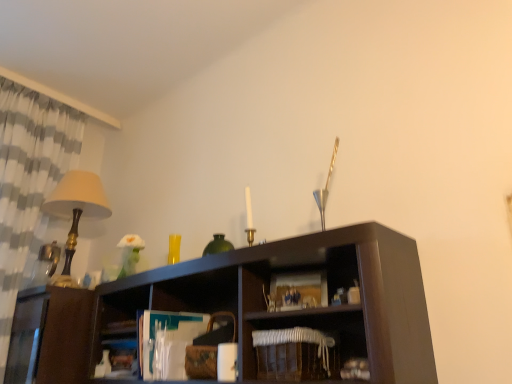
Question: Based on their positions, is white checkered fabric at left located to the left or right of matte gold table lamp at left?

Choices:
 (A) left
 (B) right

Answer: (A)

Question: Considering the positions of white checkered fabric at left and matte gold table lamp at left in the image, is white checkered fabric at left wider or thinner than matte gold table lamp at left?

Choices:
 (A) wide
 (B) thin

Answer: (A)

Question: Which object is positioned farthest from the matte gold table lamp at left?

Choices:
 (A) white woven basket at lower center
 (B) white checkered fabric at left

Answer: (A)

Question: Which of these objects is positioned farthest from the matte gold table lamp at left?

Choices:
 (A) white checkered fabric at left
 (B) white woven basket at lower center

Answer: (B)